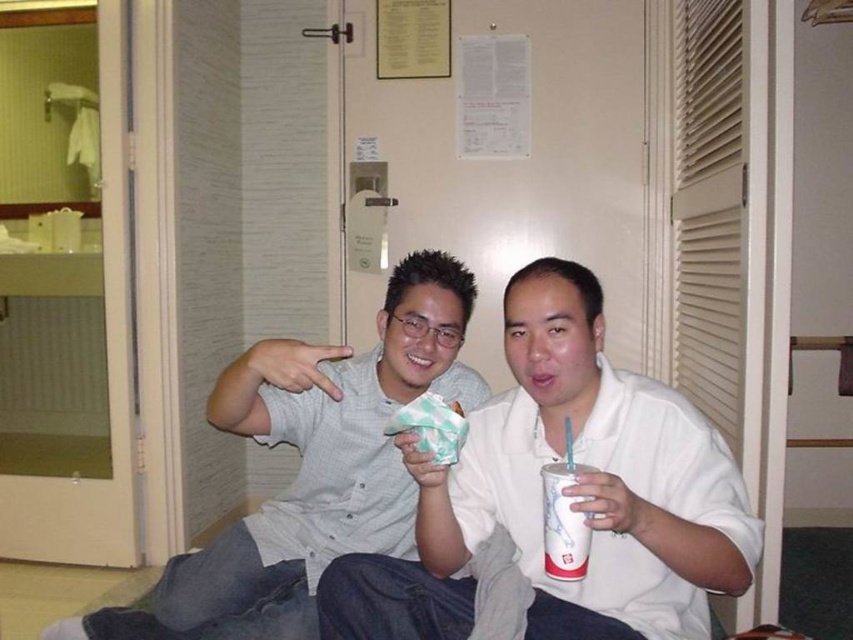
Question: Which of the following is the closest to the observer?

Choices:
 (A) white matte shirt at center
 (B) matte gray shirt at center
 (C) white paper cup at center

Answer: (A)

Question: Does white matte shirt at center appear over white paper cup at center?

Choices:
 (A) yes
 (B) no

Answer: (B)

Question: Which object appears farthest from the camera in this image?

Choices:
 (A) white matte shirt at center
 (B) matte paper ice cream cone at center
 (C) white paper cup at center
 (D) matte gray shirt at center

Answer: (D)

Question: Can you confirm if white paper cup at center is positioned above matte paper ice cream cone at center?

Choices:
 (A) no
 (B) yes

Answer: (A)

Question: Which point is farther to the camera?

Choices:
 (A) (563, 634)
 (B) (180, 570)
 (C) (398, 433)
 (D) (550, 545)

Answer: (B)

Question: From the image, what is the correct spatial relationship of white matte shirt at center in relation to matte gray shirt at center?

Choices:
 (A) above
 (B) below

Answer: (A)